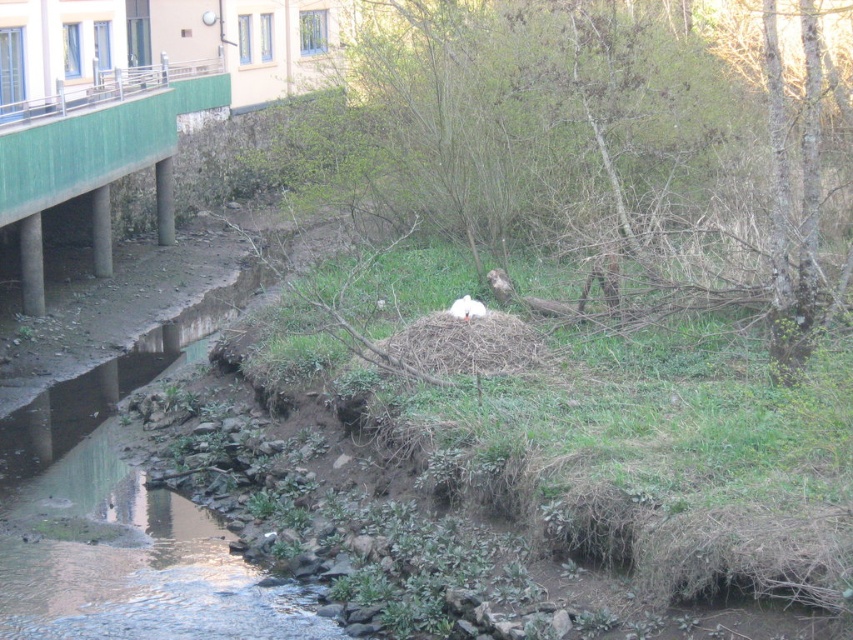
Does brown textured nest at center appear under white fluffy bird at center?

No.

Based on the photo, is brown textured nest at center closer to camera compared to white fluffy bird at center?

Yes, brown textured nest at center is closer to the viewer.

Between point (799, 179) and point (468, 300), which one is positioned in front?

Point (799, 179) is in front.

Where is `brown textured nest at center`? The width and height of the screenshot is (853, 640). brown textured nest at center is located at coordinates (607, 152).